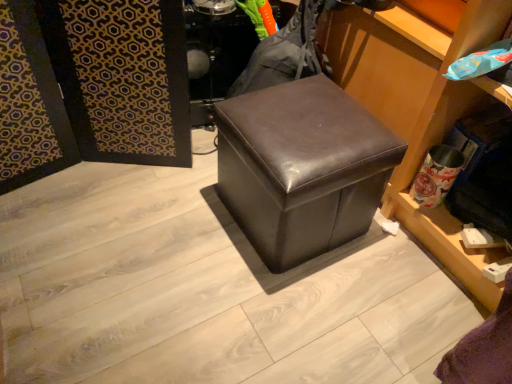
Question: Is matte brown ottoman at center outside white matte towel at lower right?

Choices:
 (A) no
 (B) yes

Answer: (B)

Question: Is matte brown ottoman at center positioned with its back to white matte towel at lower right?

Choices:
 (A) yes
 (B) no

Answer: (B)

Question: Is matte brown ottoman at center to the left of white matte towel at lower right from the viewer's perspective?

Choices:
 (A) yes
 (B) no

Answer: (A)

Question: Is white matte towel at lower right inside matte brown ottoman at center?

Choices:
 (A) no
 (B) yes

Answer: (A)

Question: From a real-world perspective, is matte brown ottoman at center physically below white matte towel at lower right?

Choices:
 (A) yes
 (B) no

Answer: (A)

Question: Is matte brown ottoman at center closer to camera compared to white matte towel at lower right?

Choices:
 (A) yes
 (B) no

Answer: (B)

Question: Does white matte towel at lower right have a lesser height compared to matte brown ottoman at center?

Choices:
 (A) no
 (B) yes

Answer: (A)

Question: Is white matte towel at lower right taller than matte brown ottoman at center?

Choices:
 (A) no
 (B) yes

Answer: (B)

Question: Is white matte towel at lower right to the left of matte brown ottoman at center from the viewer's perspective?

Choices:
 (A) yes
 (B) no

Answer: (B)

Question: Can you confirm if white matte towel at lower right is thinner than matte brown ottoman at center?

Choices:
 (A) yes
 (B) no

Answer: (A)

Question: From the image's perspective, is white matte towel at lower right under matte brown ottoman at center?

Choices:
 (A) yes
 (B) no

Answer: (A)

Question: Is white matte towel at lower right positioned beyond the bounds of matte brown ottoman at center?

Choices:
 (A) no
 (B) yes

Answer: (B)

Question: Looking at their shapes, would you say matte brown ottoman at center is wider or thinner than white matte towel at lower right?

Choices:
 (A) wide
 (B) thin

Answer: (A)